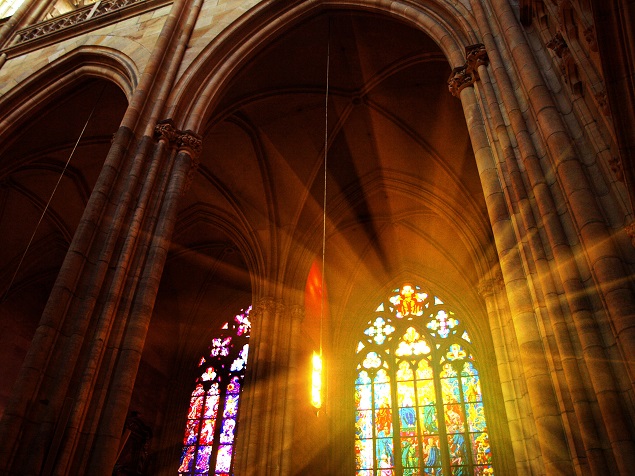
Where is `ornate brown wood between stained glass windows`? ornate brown wood between stained glass windows is located at coordinates (270, 431), (315, 442), (358, 280), (284, 289).